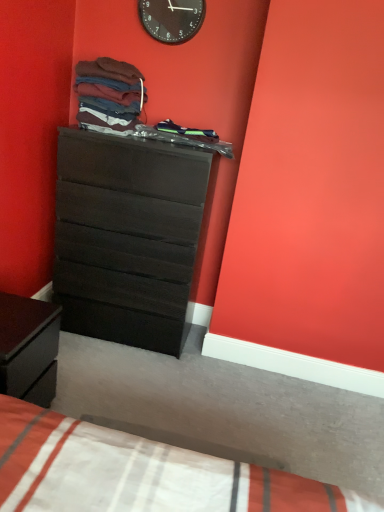
Question: Is dark wood nightstand at lower left positioned with its back to white cotton bed at lower left?

Choices:
 (A) yes
 (B) no

Answer: (B)

Question: Is dark wood nightstand at lower left taller than white cotton bed at lower left?

Choices:
 (A) yes
 (B) no

Answer: (A)

Question: From a real-world perspective, is dark wood nightstand at lower left physically above white cotton bed at lower left?

Choices:
 (A) yes
 (B) no

Answer: (A)

Question: Is dark wood nightstand at lower left to the left of white cotton bed at lower left from the viewer's perspective?

Choices:
 (A) yes
 (B) no

Answer: (A)

Question: Are dark wood nightstand at lower left and white cotton bed at lower left making contact?

Choices:
 (A) no
 (B) yes

Answer: (A)

Question: In terms of width, does dark wood nightstand at lower left look wider or thinner when compared to matte cotton shirts at upper center, the second clothing when ordered from right to left?

Choices:
 (A) wide
 (B) thin

Answer: (B)

Question: From a real-world perspective, is dark wood nightstand at lower left positioned above or below matte cotton shirts at upper center, the 1th clothing in the left-to-right sequence?

Choices:
 (A) below
 (B) above

Answer: (A)

Question: In terms of height, does dark wood nightstand at lower left look taller or shorter compared to matte cotton shirts at upper center, the 1th clothing in the left-to-right sequence?

Choices:
 (A) tall
 (B) short

Answer: (A)

Question: From the image's perspective, is dark wood nightstand at lower left positioned above or below matte cotton shirts at upper center, the second clothing when ordered from right to left?

Choices:
 (A) above
 (B) below

Answer: (B)

Question: Does point (23, 386) appear closer or farther from the camera than point (185, 135)?

Choices:
 (A) closer
 (B) farther

Answer: (A)

Question: Do you think dark wood nightstand at lower left is within dark blue fabric at center, arranged as the first clothing when viewed from the right, or outside of it?

Choices:
 (A) inside
 (B) outside

Answer: (B)

Question: Considering the relative positions of dark wood nightstand at lower left and dark blue fabric at center, the second clothing from the left, in the image provided, is dark wood nightstand at lower left to the left or to the right of dark blue fabric at center, the second clothing from the left,?

Choices:
 (A) left
 (B) right

Answer: (A)

Question: Is dark wood nightstand at lower left bigger or smaller than dark blue fabric at center, the second clothing from the left?

Choices:
 (A) small
 (B) big

Answer: (B)

Question: Considering the positions of point (24, 314) and point (96, 311), is point (24, 314) closer or farther from the camera than point (96, 311)?

Choices:
 (A) farther
 (B) closer

Answer: (B)

Question: In terms of height, does dark wood nightstand at lower left look taller or shorter compared to matte black dresser at center?

Choices:
 (A) short
 (B) tall

Answer: (A)